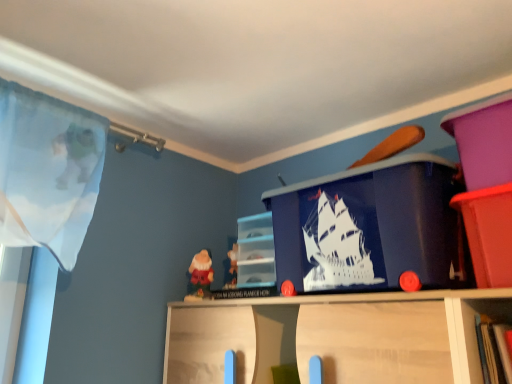
Question: Can you confirm if matte plastic bin at upper right, which is counted as the first cabinet, starting from the front, is thinner than matte plastic cabinet at center, the second cabinet positioned from the right?

Choices:
 (A) yes
 (B) no

Answer: (B)

Question: Can you confirm if matte plastic bin at upper right, which is counted as the first cabinet, starting from the front, is smaller than matte plastic cabinet at center, which is the 2th cabinet in front-to-back order?

Choices:
 (A) yes
 (B) no

Answer: (B)

Question: From the image's perspective, is matte plastic bin at upper right, which is counted as the first cabinet, starting from the front, above matte plastic cabinet at center, the 1th cabinet viewed from the back?

Choices:
 (A) no
 (B) yes

Answer: (B)

Question: From the image's perspective, is matte plastic bin at upper right, which is counted as the first cabinet, starting from the front, below matte plastic cabinet at center, the 1th cabinet viewed from the back?

Choices:
 (A) no
 (B) yes

Answer: (A)

Question: Are matte plastic bin at upper right, which is counted as the first cabinet, starting from the front, and matte plastic cabinet at center, the second cabinet positioned from the right, far apart?

Choices:
 (A) yes
 (B) no

Answer: (B)

Question: Is matte plastic bin at upper right, placed as the first cabinet when sorted from right to left, positioned in front of matte plastic cabinet at center, placed as the first cabinet when sorted from left to right?

Choices:
 (A) no
 (B) yes

Answer: (B)

Question: Is blue plastic ship at center further to the viewer compared to matte plastic bin at upper right, acting as the second cabinet starting from the left?

Choices:
 (A) no
 (B) yes

Answer: (B)

Question: Is blue plastic ship at center positioned before matte plastic bin at upper right, acting as the second cabinet starting from the left?

Choices:
 (A) yes
 (B) no

Answer: (B)

Question: Would you consider blue plastic ship at center to be distant from matte plastic bin at upper right, acting as the second cabinet starting from the left?

Choices:
 (A) no
 (B) yes

Answer: (A)

Question: Is blue plastic ship at center facing away from matte plastic bin at upper right, acting as the second cabinet starting from the left?

Choices:
 (A) yes
 (B) no

Answer: (B)

Question: From the image's perspective, is blue plastic ship at center beneath matte plastic bin at upper right, which is counted as the first cabinet, starting from the front?

Choices:
 (A) yes
 (B) no

Answer: (B)

Question: Is blue plastic ship at center directly adjacent to matte plastic bin at upper right, placed as the first cabinet when sorted from right to left?

Choices:
 (A) no
 (B) yes

Answer: (A)

Question: Is matte plastic bin at upper right, which ranks as the 2th cabinet in back-to-front order, surrounded by matte plastic cabinet at center, placed as the first cabinet when sorted from left to right?

Choices:
 (A) yes
 (B) no

Answer: (B)